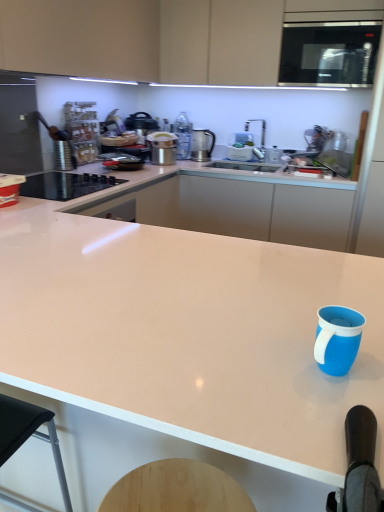
Image resolution: width=384 pixels, height=512 pixels. Find the location of `unoccupied area in front of satin silver kettle at upper center, marked as the 1th kitchen appliance in a right-to-left arrangement`. unoccupied area in front of satin silver kettle at upper center, marked as the 1th kitchen appliance in a right-to-left arrangement is located at coordinates (197, 162).